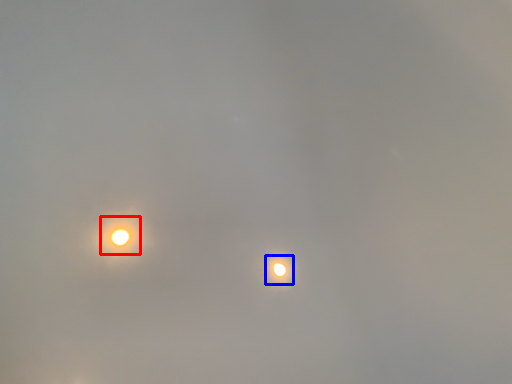
Question: Among these objects, which one is nearest to the camera, moonlight (highlighted by a red box) or moonlight (highlighted by a blue box)?

Choices:
 (A) moonlight
 (B) moonlight

Answer: (A)